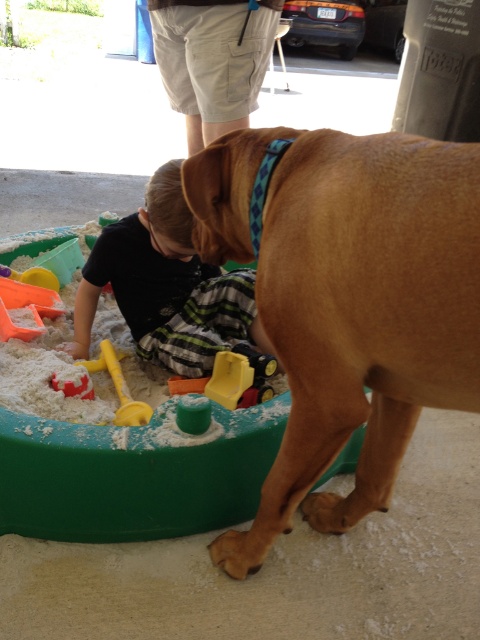
You are a parent supervising the sandbox area. You need to retrieve the yellow plastic shovel at lower left without disturbing the golden fur dog at right. Is the shovel accessible from your current position?

The golden fur dog at right is above the yellow plastic shovel at lower left, so the shovel is positioned below the dog. Since the dog is standing above it, you can carefully move around the dog to reach the shovel without disturbing it.

You are a parent watching your child play in the sandbox. You notice a golden fur dog at right and a red plastic shovel at lower left. Which object is closer to you?

The golden fur dog at right is closer to you because it is in front of the red plastic shovel at lower left.

You are a parent watching your child play in the sandbox. You notice the black cotton shirt at lower left and the red plastic shovel at lower left. Which item is more likely to block the child from reaching the red bucket in the center? Please explain based on their positions and sizes.

The black cotton shirt at lower left is wider than the red plastic shovel at lower left, so it is more likely to block the child from reaching the red bucket in the center if both are in the same area.